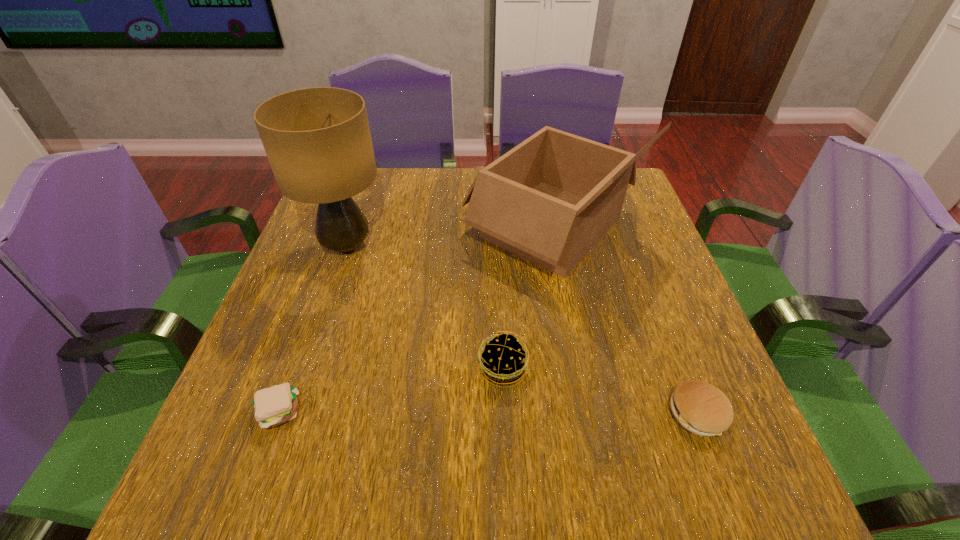
Where is `lampshade`? The width and height of the screenshot is (960, 540). lampshade is located at coordinates 318,142.

Identify the location of box. The height and width of the screenshot is (540, 960). (550, 199).

Find the location of a particular element. the tallest patty is located at coordinates (502, 362).

Find the location of a particular element. Image resolution: width=960 pixels, height=540 pixels. the second patty from left to right is located at coordinates pos(502,362).

At what (x,y) coordinates should I click in order to perform the action: click on the rightmost patty. Please return your answer as a coordinate pair (x, y). Looking at the image, I should click on (699, 407).

Where is `the shortest object`? The width and height of the screenshot is (960, 540). the shortest object is located at coordinates (273, 406).

This screenshot has height=540, width=960. I want to click on the shortest patty, so click(273, 406).

Where is `free space located on the front of the tallest object`? This screenshot has width=960, height=540. free space located on the front of the tallest object is located at coordinates (305, 370).

Find the location of a particular element. The image size is (960, 540). vacant area situated 0.360m on the left of the box is located at coordinates click(x=324, y=227).

Locate an element on the screen. The image size is (960, 540). vacant space situated on the left of the third tallest object is located at coordinates (282, 369).